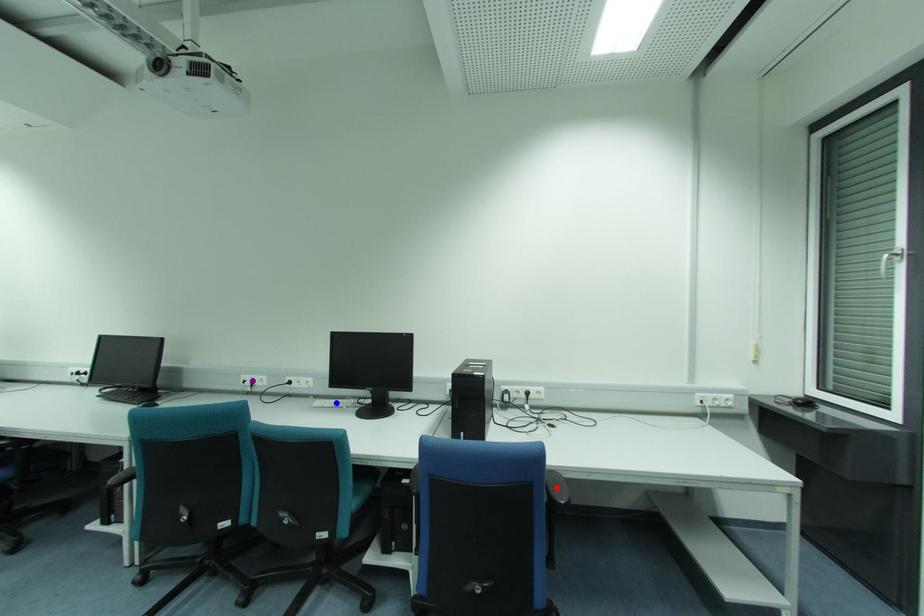
Order these from nearest to farthest:
purple point, red point, blue point

red point → blue point → purple point